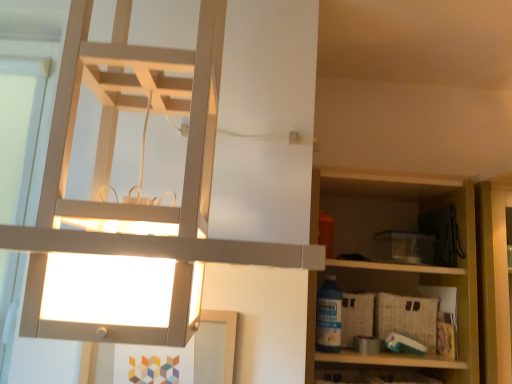
Question: From a real-world perspective, is woven beige crate at lower right above or below matte white lamp at upper left?

Choices:
 (A) above
 (B) below

Answer: (B)

Question: Is point (417, 312) positioned closer to the camera than point (141, 236)?

Choices:
 (A) farther
 (B) closer

Answer: (A)

Question: Based on their relative distances, which object is nearer to the blue plastic bottle at lower right?

Choices:
 (A) wooden shelf at right
 (B) matte white lamp at upper left
 (C) woven beige crate at lower right

Answer: (C)

Question: Estimate the real-world distances between objects in this image. Which object is closer to the blue plastic bottle at lower right?

Choices:
 (A) woven beige crate at lower right
 (B) matte white lamp at upper left
 (C) wooden shelf at right

Answer: (A)